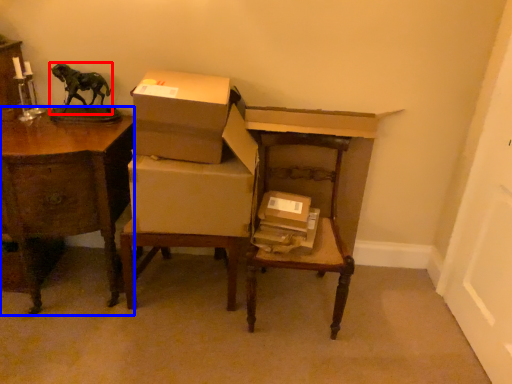
Question: Among these objects, which one is farthest to the camera, animal (highlighted by a red box) or desk (highlighted by a blue box)?

Choices:
 (A) animal
 (B) desk

Answer: (A)